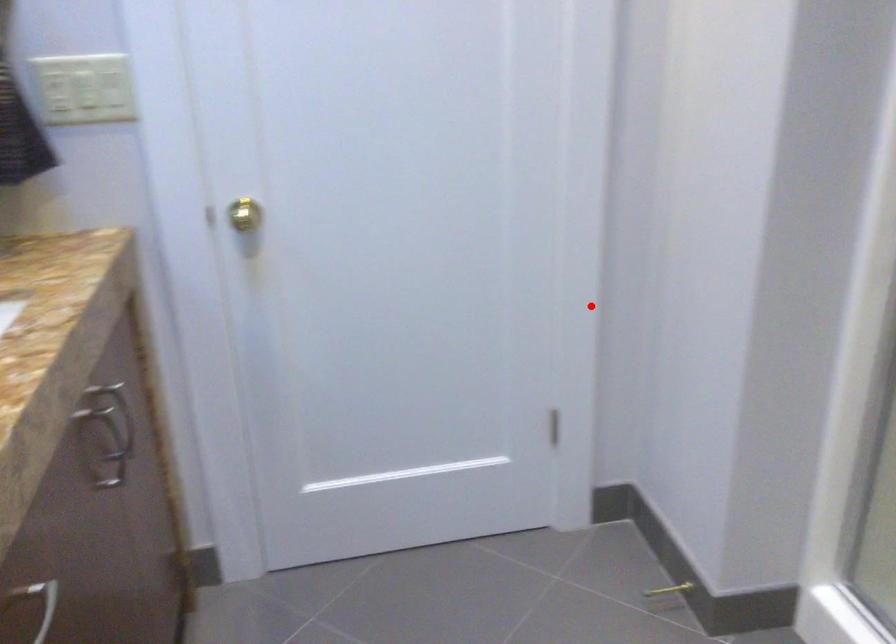
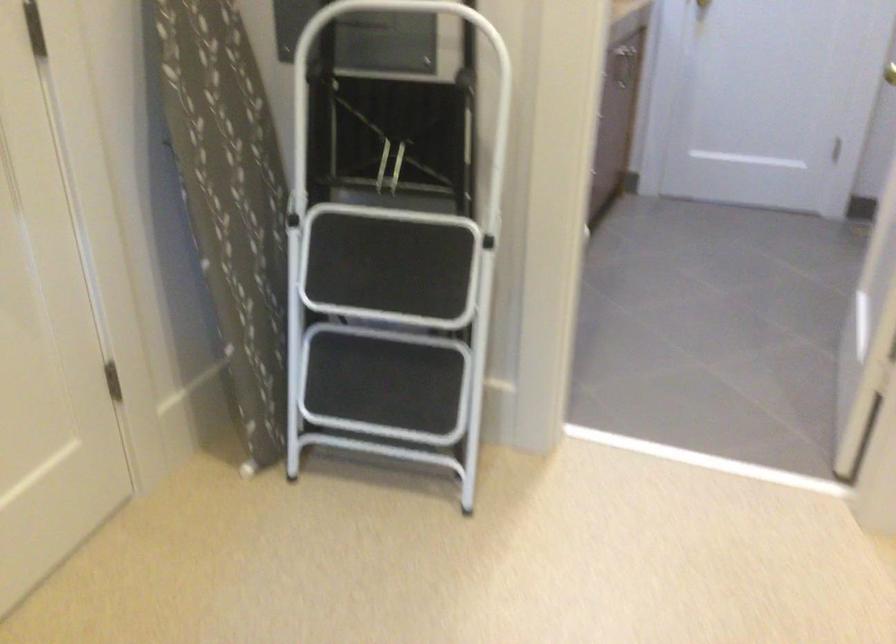
Question: I am providing you with two images of the same scene from different viewpoints. In image1, a red point is highlighted. Considering the same 3D point in image2, which of the following is correct?

Choices:
 (A) It is closer
 (B) It is farther

Answer: (B)